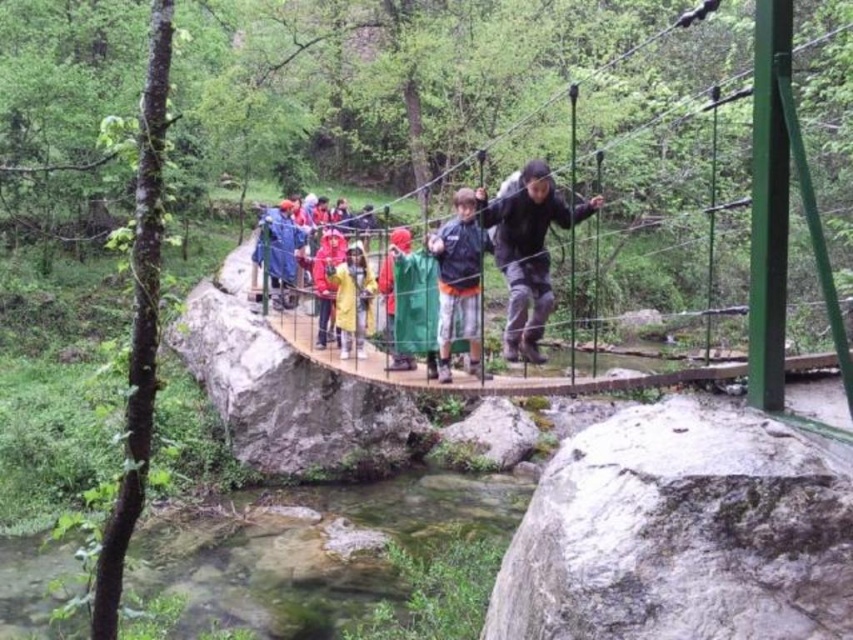
Is gray/rough rock at lower right wider than matte black jacket at center?

Correct, the width of gray/rough rock at lower right exceeds that of matte black jacket at center.

Can you confirm if gray/rough rock at lower right is shorter than matte black jacket at center?

Indeed, gray/rough rock at lower right has a lesser height compared to matte black jacket at center.

Between point (556, 524) and point (511, 212), which one is positioned in front?

Point (556, 524)

The height and width of the screenshot is (640, 853). I want to click on gray/rough rock at lower right, so (682, 532).

Can you confirm if smooth gray rock at center is shorter than blue waterproof jacket at center?

No, smooth gray rock at center is not shorter than blue waterproof jacket at center.

Can you confirm if smooth gray rock at center is positioned to the right of blue waterproof jacket at center?

In fact, smooth gray rock at center is to the left of blue waterproof jacket at center.

The height and width of the screenshot is (640, 853). Identify the location of smooth gray rock at center. (291, 397).

Which of these two, gray/rough rock at lower right or yellow waterproof jacket at center, stands taller?

Standing taller between the two is yellow waterproof jacket at center.

Between point (651, 477) and point (363, 332), which one is positioned in front?

Positioned in front is point (651, 477).

This screenshot has width=853, height=640. What are the coordinates of `gray/rough rock at lower right` in the screenshot? It's located at (682, 532).